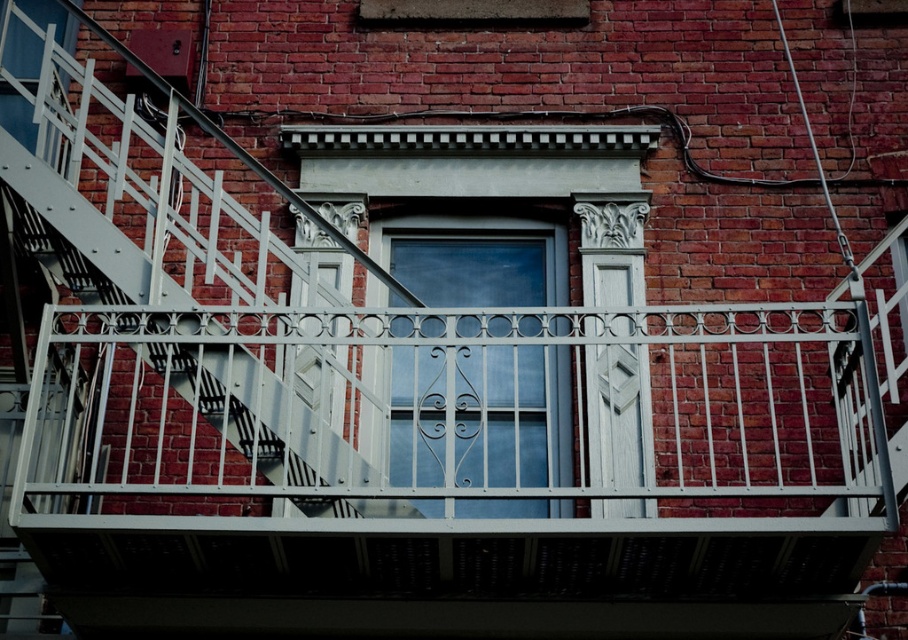
Question: Which point is farther to the camera?

Choices:
 (A) (469, 284)
 (B) (41, 58)

Answer: (B)

Question: Is clear glass window at center to the right of matte white window at upper left from the viewer's perspective?

Choices:
 (A) yes
 (B) no

Answer: (A)

Question: Among these points, which one is nearest to the camera?

Choices:
 (A) (486, 401)
 (B) (38, 51)

Answer: (A)

Question: Is the position of clear glass window at center less distant than that of matte white window at upper left?

Choices:
 (A) no
 (B) yes

Answer: (B)

Question: Is clear glass window at center bigger than matte white window at upper left?

Choices:
 (A) no
 (B) yes

Answer: (B)